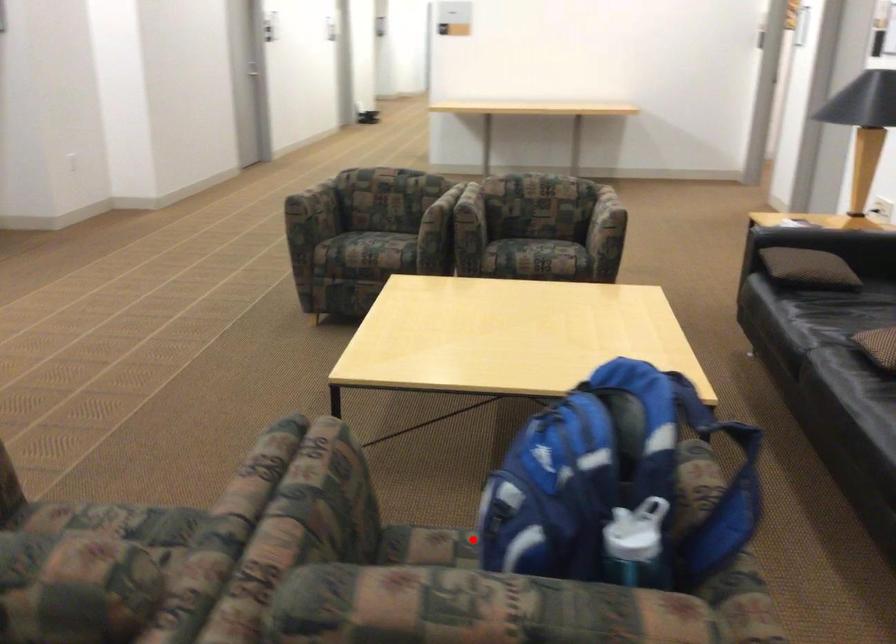
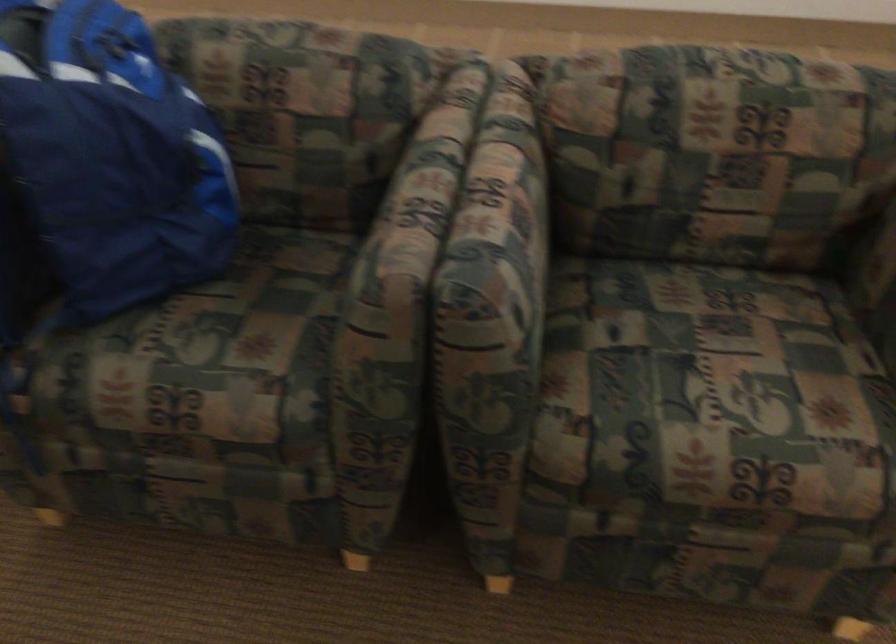
Question: I am providing you with two images of the same scene from different viewpoints. In image1, a red point is highlighted. Considering the same 3D point in image2, which of the following is correct?

Choices:
 (A) It is closer
 (B) It is farther

Answer: (A)